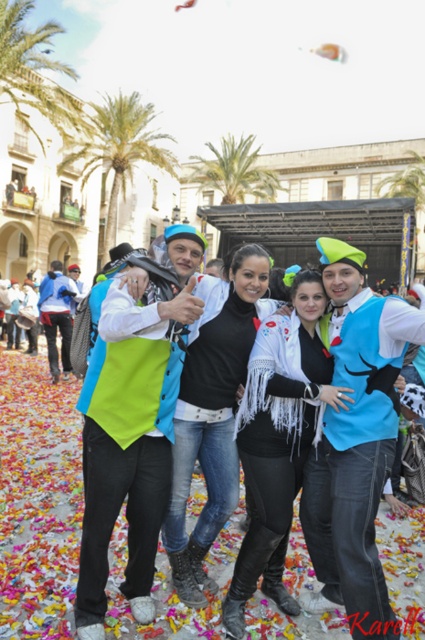
Question: Where is white fringed jacket at center located in relation to green leafy palm tree at center in the image?

Choices:
 (A) left
 (B) right

Answer: (B)

Question: Considering the relative positions of white fringed jacket at center and black matte jacket at center in the image provided, where is white fringed jacket at center located with respect to black matte jacket at center?

Choices:
 (A) right
 (B) left

Answer: (A)

Question: Can you confirm if blue felt vest at center is thinner than white fringed jacket at center?

Choices:
 (A) no
 (B) yes

Answer: (B)

Question: Based on their relative distances, which object is nearer to the black matte jacket at center?

Choices:
 (A) green leafy palm tree at upper left
 (B) white fringed jacket at center
 (C) blue felt vest at center
 (D) green leafy palm tree at center

Answer: (B)

Question: Estimate the real-world distances between objects in this image. Which object is farther from the black matte jacket at center?

Choices:
 (A) green leafy palm tree at center
 (B) green leafy palm tree at upper left

Answer: (A)

Question: Which point is farther to the camera?

Choices:
 (A) (127, 157)
 (B) (207, 448)
 (C) (359, 445)

Answer: (A)